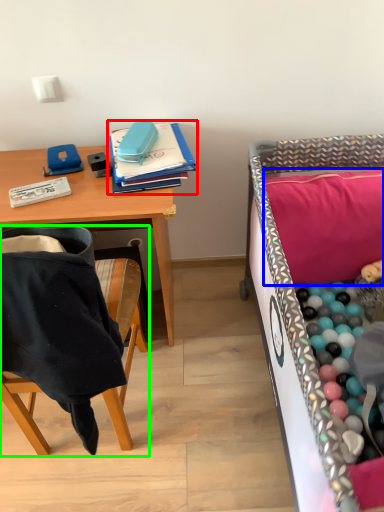
Question: Based on their relative distances, which object is nearer to notebook (highlighted by a red box)? Choose from pillow (highlighted by a blue box) and chair (highlighted by a green box).

Choices:
 (A) pillow
 (B) chair

Answer: (B)